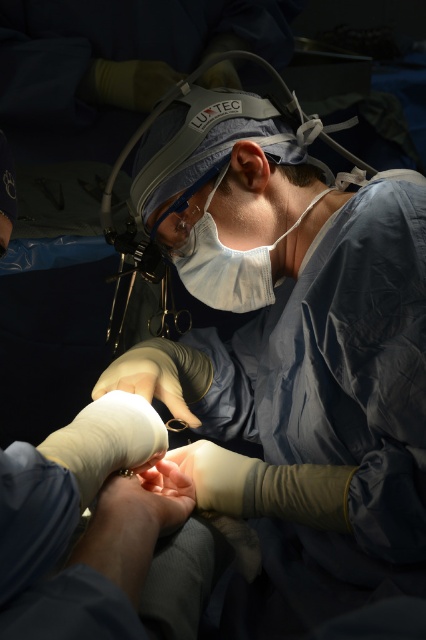
In the scene shown: You are a medical student observing a surgery. The surgeon is using two instruments marked as point coordinates. The first instrument is at point (307, 200) and the second is at point (158, 280). Which instrument is closer to you?

Point (307, 200) is closer to the viewer than point (158, 280).

In the operating room scene, the surgeon is wearing two items at the center. One is the white fabric mask at center and the other is the matte plastic surgical loupes at center. Which of these two items is positioned higher on the surgeon?

The white fabric mask at center is above the matte plastic surgical loupes at center, so the white fabric mask at center is positioned higher on the surgeon.

In the operating room scene, you notice the white fabric mask at center and the matte plastic surgical loupes at center. Which of these two items is smaller in size?

The white fabric mask at center has a smaller size compared to the matte plastic surgical loupes at center, so the white fabric mask at center is smaller.